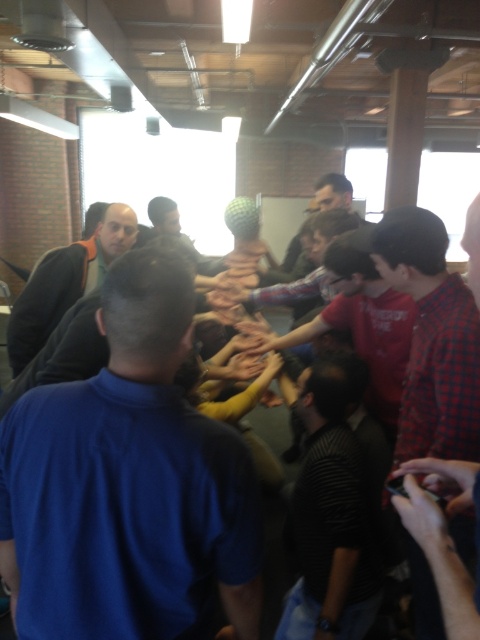
Is smooth black phone at lower right taller than camouflage fabric shirt at center?

In fact, smooth black phone at lower right may be shorter than camouflage fabric shirt at center.

Is smooth black phone at lower right to the left of camouflage fabric shirt at center from the viewer's perspective?

No, smooth black phone at lower right is not to the left of camouflage fabric shirt at center.

Which is behind, point (418, 532) or point (168, 221)?

The point (168, 221) is more distant.

Identify the location of smooth black phone at lower right. (420, 512).

Which is above, dark striped shirt at center or smooth black phone at lower right?

Positioned higher is smooth black phone at lower right.

Is dark striped shirt at center positioned in front of smooth black phone at lower right?

No, it is not.

Between point (334, 538) and point (404, 490), which one is positioned behind?

The point (334, 538) is behind.

Where is `dark striped shirt at center`? The height and width of the screenshot is (640, 480). dark striped shirt at center is located at coordinates (332, 513).

Looking at this image, is dark gray sweater at left above camouflage fabric shirt at center?

Incorrect, dark gray sweater at left is not positioned above camouflage fabric shirt at center.

Based on the photo, is dark gray sweater at left bigger than camouflage fabric shirt at center?

Yes.

Between point (17, 330) and point (157, 224), which one is positioned in front?

Point (17, 330) is more forward.

Image resolution: width=480 pixels, height=640 pixels. What are the coordinates of `dark gray sweater at left` in the screenshot? It's located at (66, 282).